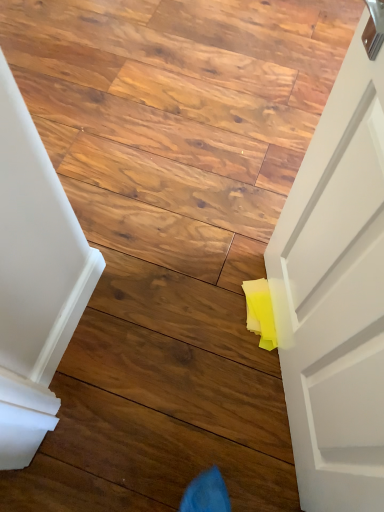
Question: Is yellow paper at lower right thinner than smooth wood plank at center?

Choices:
 (A) no
 (B) yes

Answer: (A)

Question: Can you confirm if yellow paper at lower right is taller than smooth wood plank at center?

Choices:
 (A) no
 (B) yes

Answer: (A)

Question: Is there a large distance between yellow paper at lower right and smooth wood plank at center?

Choices:
 (A) no
 (B) yes

Answer: (A)

Question: Is yellow paper at lower right in front of smooth wood plank at center?

Choices:
 (A) yes
 (B) no

Answer: (B)

Question: Considering the relative positions of yellow paper at lower right and smooth wood plank at center in the image provided, is yellow paper at lower right to the right of smooth wood plank at center from the viewer's perspective?

Choices:
 (A) no
 (B) yes

Answer: (A)

Question: Is yellow paper at lower right directly adjacent to smooth wood plank at center?

Choices:
 (A) yes
 (B) no

Answer: (B)

Question: From a real-world perspective, is smooth wood plank at center beneath yellow paper at lower right?

Choices:
 (A) no
 (B) yes

Answer: (A)

Question: Is smooth wood plank at center facing towards yellow paper at lower right?

Choices:
 (A) yes
 (B) no

Answer: (B)

Question: Does smooth wood plank at center contain yellow paper at lower right?

Choices:
 (A) yes
 (B) no

Answer: (B)

Question: Is smooth wood plank at center shorter than yellow paper at lower right?

Choices:
 (A) yes
 (B) no

Answer: (B)

Question: Are smooth wood plank at center and yellow paper at lower right making contact?

Choices:
 (A) yes
 (B) no

Answer: (B)

Question: Would you consider smooth wood plank at center to be distant from yellow paper at lower right?

Choices:
 (A) yes
 (B) no

Answer: (B)

Question: From a real-world perspective, is smooth wood plank at center positioned above or below yellow paper at lower right?

Choices:
 (A) below
 (B) above

Answer: (B)